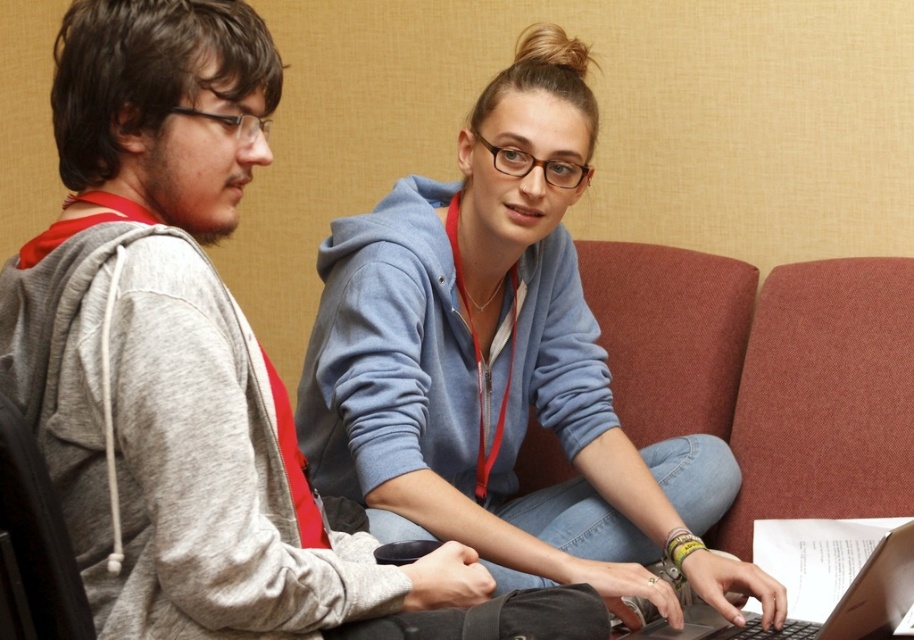
Question: Which point is farther to the camera?

Choices:
 (A) (348, 268)
 (B) (208, 68)

Answer: (A)

Question: Observing the image, what is the correct spatial positioning of blue fleece hoodie at center in reference to silver metallic laptop at center?

Choices:
 (A) left
 (B) right

Answer: (A)

Question: Is gray matte hoodie at upper left closer to the viewer compared to silver metallic laptop at center?

Choices:
 (A) yes
 (B) no

Answer: (A)

Question: Is gray matte hoodie at upper left below blue fleece hoodie at center?

Choices:
 (A) no
 (B) yes

Answer: (A)

Question: Among these points, which one is farthest from the camera?

Choices:
 (A) (384, 262)
 (B) (884, 557)
 (C) (194, 440)

Answer: (A)

Question: Which point is farther to the camera?

Choices:
 (A) gray matte hoodie at upper left
 (B) blue fleece hoodie at center

Answer: (B)